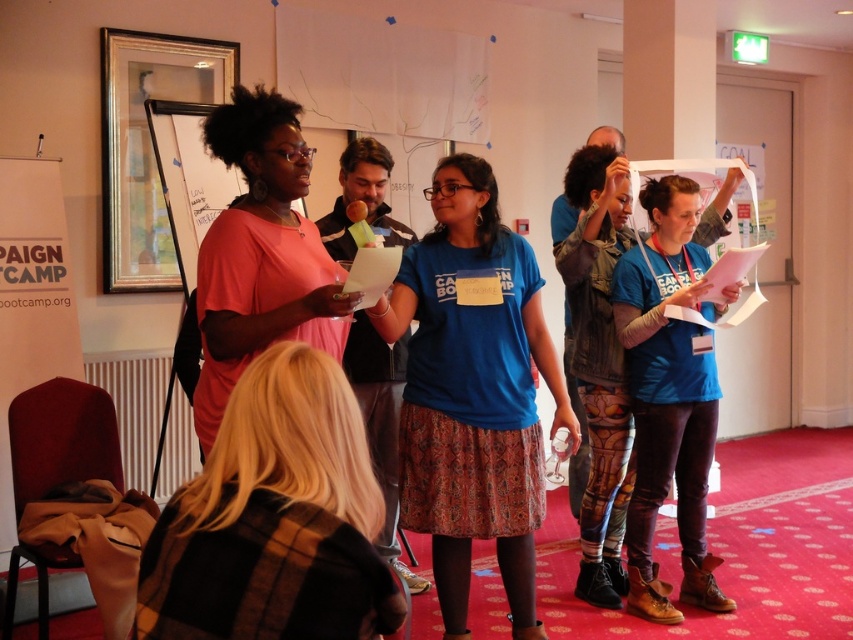
You are organizing a photo shoot and need to ensure that two models wearing the blue cotton shirt at center and the blue printed leggings at center can stand side by side in a frame without overlapping. Based on their positions and sizes in the image, do you think they can fit comfortably next to each other?

The blue cotton shirt at center might be wider than blue printed leggings at center, so there might not be enough space for them to stand side by side comfortably without overlapping.

Please look at the point marked at coordinates (473, 392) in the image. What object is located at this point?

The point at (473, 392) corresponds to the blue cotton t shirt at center.

You are a photographer trying to capture a clear shot of both the blue cotton shirt at center and the white paper at left. Based on their sizes in the image, which one should you focus on first to ensure it appears sharp in the photo?

The blue cotton shirt at center is taller than the white paper at left, so you should focus on the blue cotton shirt at center first to ensure it appears sharp since it is larger in the frame.